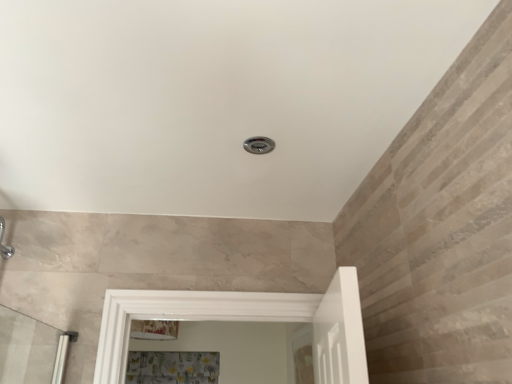
Question: Is floral fabric shower curtain at lower center wider or thinner than clear glass screen door at center?

Choices:
 (A) wide
 (B) thin

Answer: (A)

Question: From the image's perspective, relative to clear glass screen door at center, is floral fabric shower curtain at lower center above or below?

Choices:
 (A) below
 (B) above

Answer: (A)

Question: Estimate the real-world distances between objects in this image. Which object is farther from the clear glass screen door at center?

Choices:
 (A) brushed metal shower at center
 (B) floral fabric shower curtain at lower center

Answer: (A)

Question: Considering the real-world distances, which object is farthest from the clear glass screen door at center?

Choices:
 (A) brushed metal shower at center
 (B) floral fabric shower curtain at lower center

Answer: (A)